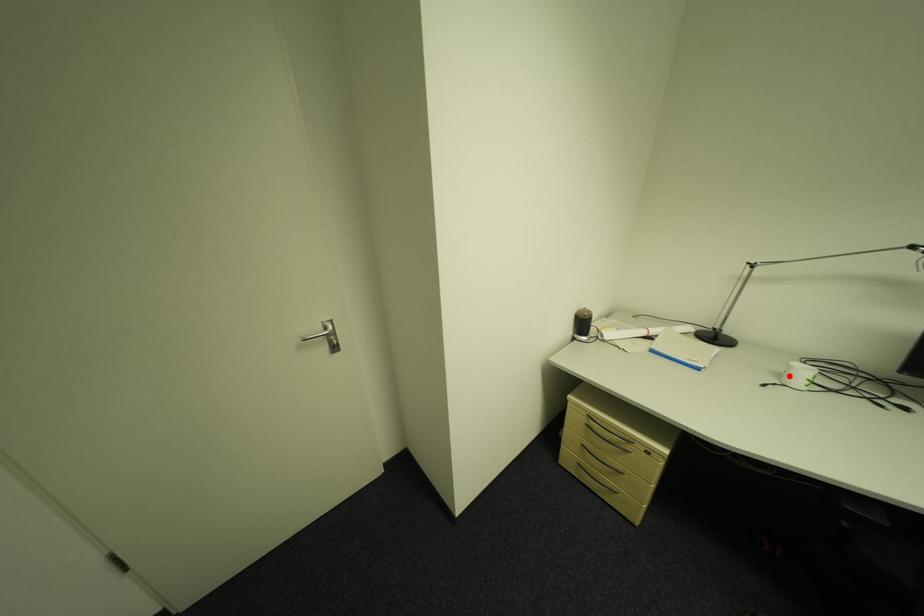
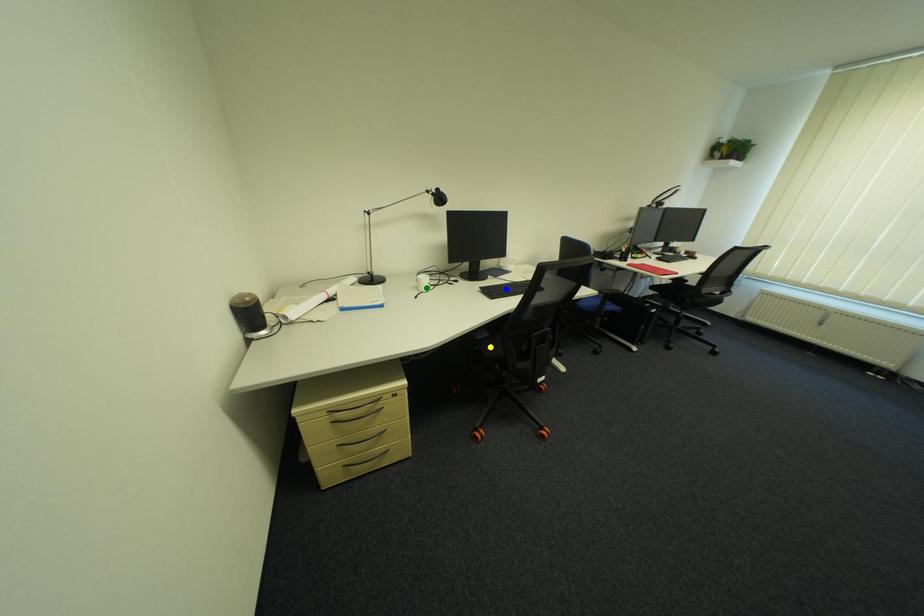
Question: I am providing you with two images of the same scene from different viewpoints. A red point is marked on the first image. You are given multiple points on the second image. Which point in image 2 is actually the same real-world point as the red point in image 1?

Choices:
 (A) yellow point
 (B) green point
 (C) blue point

Answer: (B)